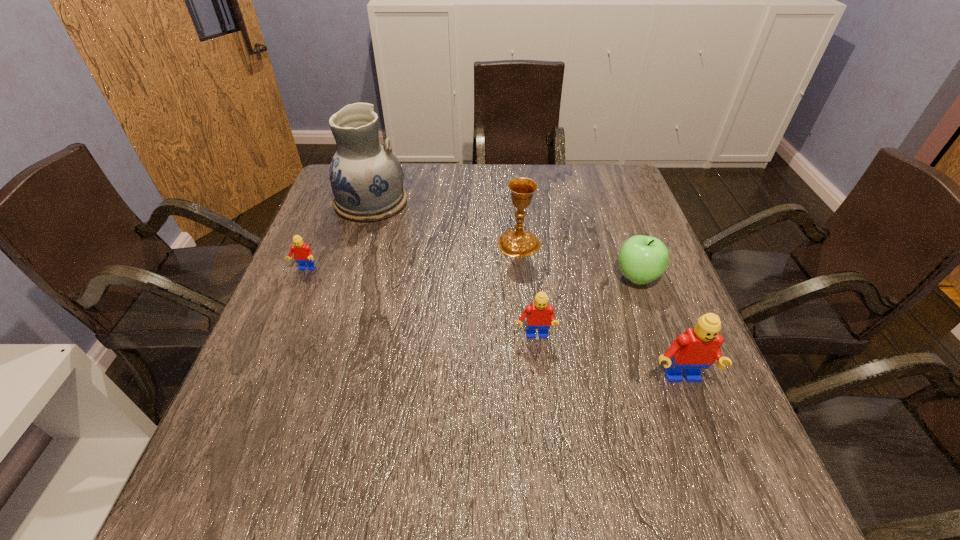
Identify the location of blank space located on the front-facing side of the leftmost Lego. (282, 325).

At what (x,y) coordinates should I click in order to perform the action: click on vacant space located on the front-facing side of the fifth farthest object. Please return your answer as a coordinate pair (x, y). The height and width of the screenshot is (540, 960). Looking at the image, I should click on (543, 420).

This screenshot has width=960, height=540. Find the location of `vacant space located on the front-facing side of the tallest Lego`. vacant space located on the front-facing side of the tallest Lego is located at coordinates (705, 449).

Image resolution: width=960 pixels, height=540 pixels. What are the coordinates of `free spot located on the right of the tallest object` in the screenshot? It's located at (502, 202).

Where is `free space located 0.170m on the back of the apple`? This screenshot has width=960, height=540. free space located 0.170m on the back of the apple is located at coordinates (616, 221).

The image size is (960, 540). In order to click on free spot located on the left of the chalice in this screenshot , I will do `click(410, 244)`.

Identify the location of object located at the far edge. The image size is (960, 540). (366, 177).

This screenshot has width=960, height=540. I want to click on Lego that is at the left edge, so click(302, 253).

Where is `pottery at the left edge`? The width and height of the screenshot is (960, 540). pottery at the left edge is located at coordinates (366, 177).

At what (x,y) coordinates should I click in order to perform the action: click on Lego that is at the right edge. Please return your answer as a coordinate pair (x, y). The height and width of the screenshot is (540, 960). Looking at the image, I should click on (697, 348).